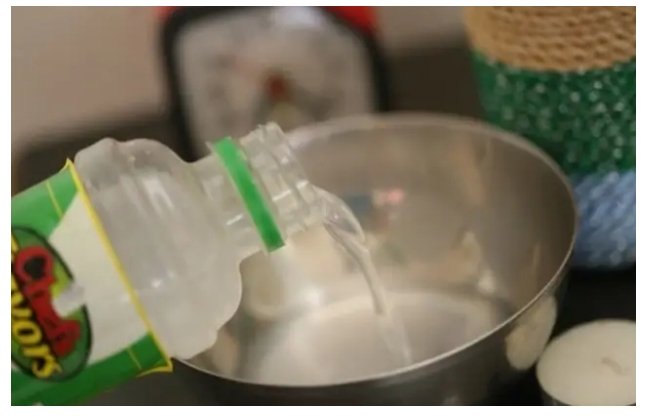
Image resolution: width=650 pixels, height=420 pixels. I want to click on face of the clock, white, so click(x=251, y=46).